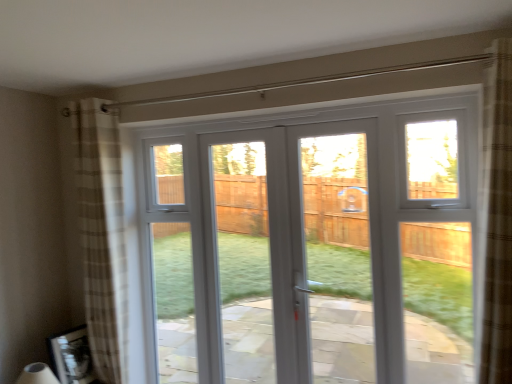
Question: Considering the relative sizes of plaid fabric curtain at left and white plastic door at center in the image provided, is plaid fabric curtain at left shorter than white plastic door at center?

Choices:
 (A) no
 (B) yes

Answer: (A)

Question: From a real-world perspective, is plaid fabric curtain at left located beneath white plastic door at center?

Choices:
 (A) yes
 (B) no

Answer: (B)

Question: Does plaid fabric curtain at left contain white plastic door at center?

Choices:
 (A) no
 (B) yes

Answer: (A)

Question: Is plaid fabric curtain at left not within white plastic door at center?

Choices:
 (A) yes
 (B) no

Answer: (A)

Question: Can you confirm if plaid fabric curtain at left is wider than white plastic door at center?

Choices:
 (A) no
 (B) yes

Answer: (B)

Question: Considering the relative positions of plaid fabric curtain at left and white plastic door at center in the image provided, is plaid fabric curtain at left behind white plastic door at center?

Choices:
 (A) yes
 (B) no

Answer: (A)

Question: Can you confirm if white plastic door at center is smaller than plaid fabric curtain at left?

Choices:
 (A) no
 (B) yes

Answer: (B)

Question: Are white plastic door at center and plaid fabric curtain at left making contact?

Choices:
 (A) yes
 (B) no

Answer: (B)

Question: Considering the relative positions of white plastic door at center and plaid fabric curtain at left in the image provided, is white plastic door at center to the left of plaid fabric curtain at left from the viewer's perspective?

Choices:
 (A) yes
 (B) no

Answer: (B)

Question: From a real-world perspective, is white plastic door at center on plaid fabric curtain at left?

Choices:
 (A) no
 (B) yes

Answer: (A)

Question: Is white plastic door at center taller than plaid fabric curtain at left?

Choices:
 (A) yes
 (B) no

Answer: (B)

Question: From the image's perspective, is white plastic door at center on plaid fabric curtain at left?

Choices:
 (A) no
 (B) yes

Answer: (A)

Question: Would you say plaid fabric curtain at left is a long distance from white plastic window at center?

Choices:
 (A) yes
 (B) no

Answer: (B)